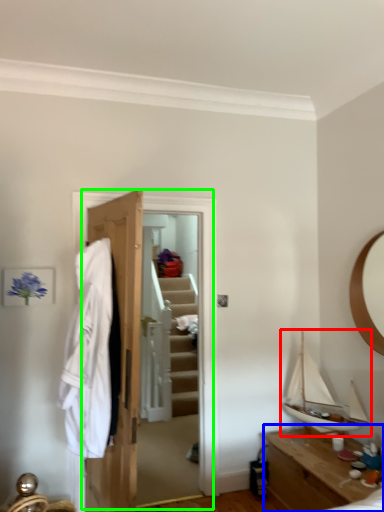
Question: Which object is the farthest from boat (highlighted by a red box)? Choose among these: table (highlighted by a blue box) or closet (highlighted by a green box).

Choices:
 (A) table
 (B) closet

Answer: (B)